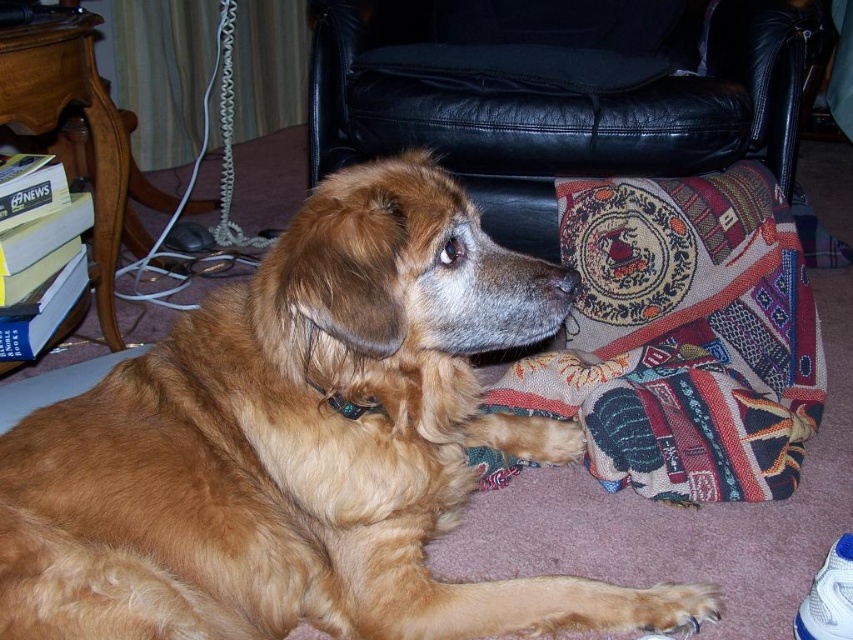
The height and width of the screenshot is (640, 853). What are the coordinates of `golden fur dog at center` in the screenshot? It's located at (305, 445).

Can you confirm if golden fur dog at center is positioned to the left of black leather armchair at upper center?

Yes, golden fur dog at center is to the left of black leather armchair at upper center.

At what (x,y) coordinates should I click in order to perform the action: click on golden fur dog at center. Please return your answer as a coordinate pair (x, y). Looking at the image, I should click on (305, 445).